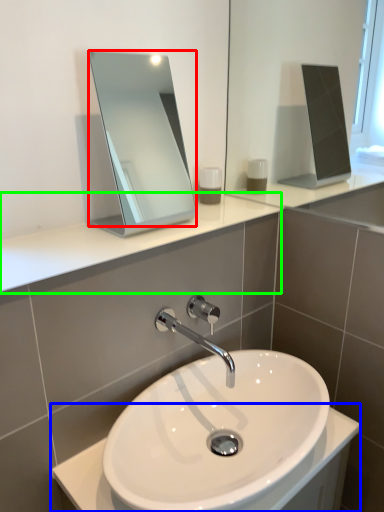
Question: Which is farther away from mirror (highlighted by a red box)? counter top (highlighted by a blue box) or counter top (highlighted by a green box)?

Choices:
 (A) counter top
 (B) counter top

Answer: (A)